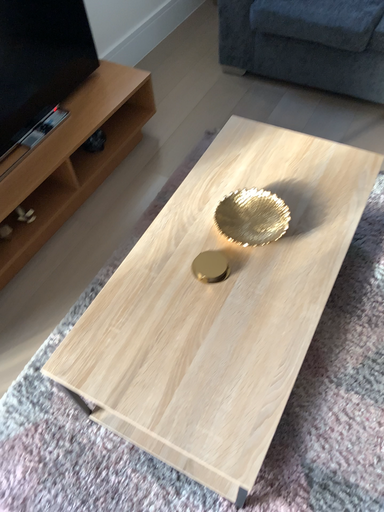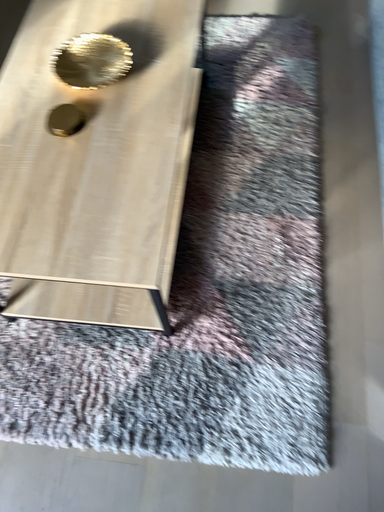
Question: Which way did the camera rotate in the video?

Choices:
 (A) rotated left
 (B) rotated right

Answer: (B)